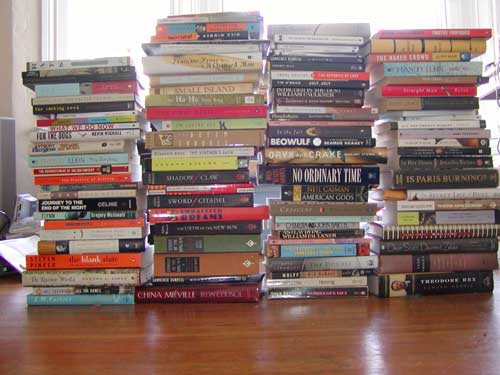
This screenshot has height=375, width=500. Identify the location of papers. (12, 249).